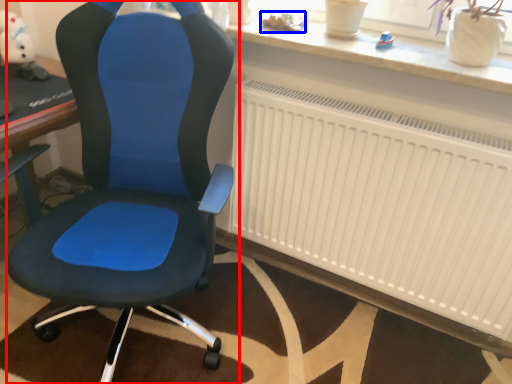
Question: Which point is further to the camera, chair (highlighted by a red box) or toy (highlighted by a blue box)?

Choices:
 (A) chair
 (B) toy

Answer: (B)